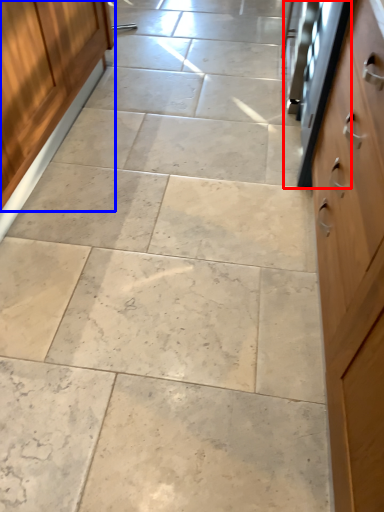
Question: Among these objects, which one is nearest to the camera, oven (highlighted by a red box) or cabinetry (highlighted by a blue box)?

Choices:
 (A) oven
 (B) cabinetry

Answer: (B)